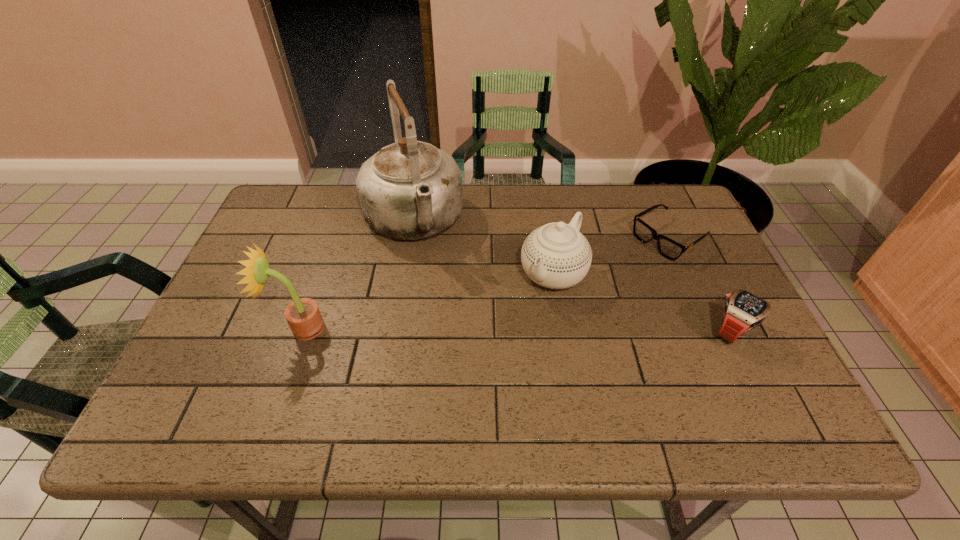
What are the coordinates of `free space located on the face of the second tallest object` in the screenshot? It's located at (246, 328).

Where is `blank area located on the back of the second shortest object`? The height and width of the screenshot is (540, 960). blank area located on the back of the second shortest object is located at coordinates (686, 237).

This screenshot has height=540, width=960. In order to click on vacant space located on the spout of the chinaware in this screenshot , I will do `click(483, 365)`.

Find the location of `vacant point located 0.320m on the spout of the chinaware`. vacant point located 0.320m on the spout of the chinaware is located at coordinates (461, 392).

At what (x,y) coordinates should I click in order to perform the action: click on free location located 0.310m on the spout of the chinaware. Please return your answer as a coordinate pair (x, y). The height and width of the screenshot is (540, 960). Looking at the image, I should click on (464, 389).

Identify the location of free spot located at the spout of the kettle. (451, 330).

At what (x,y) coordinates should I click in order to perform the action: click on free region located at the spout of the kettle. Please return your answer as a coordinate pair (x, y). This screenshot has height=540, width=960. Looking at the image, I should click on (462, 357).

The width and height of the screenshot is (960, 540). What are the coordinates of `vacant area situated at the spout of the kettle` in the screenshot? It's located at (444, 308).

Locate an element on the screen. free region located 0.310m on the front-facing side of the sunglasses is located at coordinates (564, 306).

This screenshot has height=540, width=960. What are the coordinates of `vacant region located 0.360m on the front-facing side of the sunglasses` in the screenshot? It's located at (549, 315).